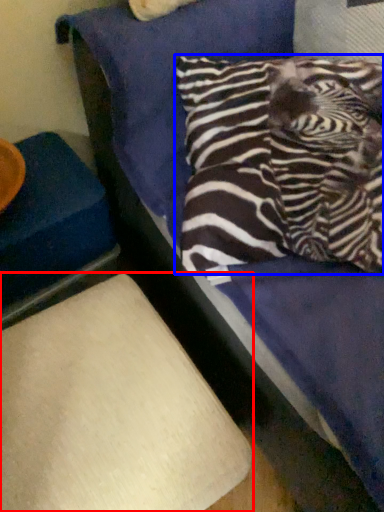
Question: Which point is closer to the camera, furniture (highlighted by a red box) or pillow (highlighted by a blue box)?

Choices:
 (A) furniture
 (B) pillow

Answer: (A)